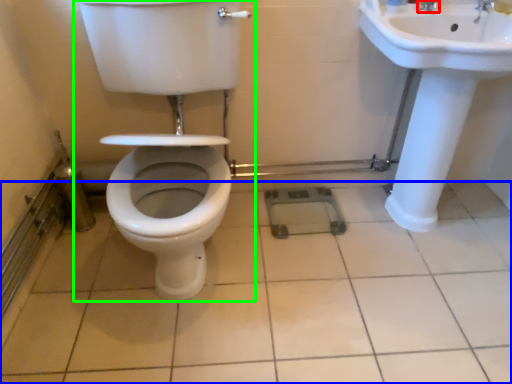
Question: Which is farther away from tap (highlighted by a red box)? ceramic tile (highlighted by a blue box) or toilet (highlighted by a green box)?

Choices:
 (A) ceramic tile
 (B) toilet

Answer: (A)